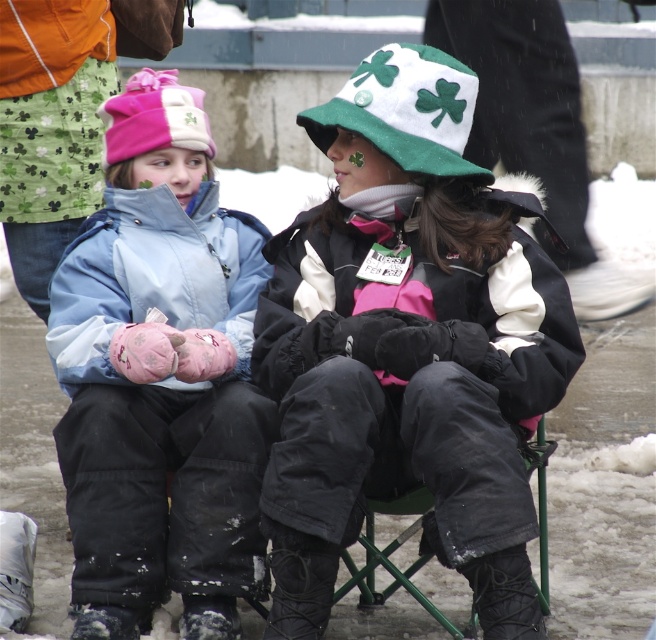
Does white matte hat at center come behind green metal folding chair at lower center?

No.

Measure the distance between white matte hat at center and green metal folding chair at lower center.

white matte hat at center and green metal folding chair at lower center are 19.26 inches apart from each other.

Between point (543, 385) and point (544, 452), which one is positioned behind?

The point (544, 452) is more distant.

Image resolution: width=656 pixels, height=640 pixels. In order to click on white matte hat at center in this screenshot , I will do `click(407, 346)`.

Who is taller, white matte hat at center or matte blue jacket at center?

matte blue jacket at center is taller.

Does white matte hat at center have a greater width compared to matte blue jacket at center?

Correct, the width of white matte hat at center exceeds that of matte blue jacket at center.

Identify the location of white matte hat at center. (407, 346).

Is matte blue jacket at center thinner than green metal folding chair at lower center?

Indeed, matte blue jacket at center has a lesser width compared to green metal folding chair at lower center.

Measure the distance between matte blue jacket at center and camera.

5.20 meters

Between point (134, 100) and point (546, 563), which one is positioned in front?

Point (134, 100) is in front.

The height and width of the screenshot is (640, 656). In order to click on matte blue jacket at center in this screenshot , I will do `click(159, 378)`.